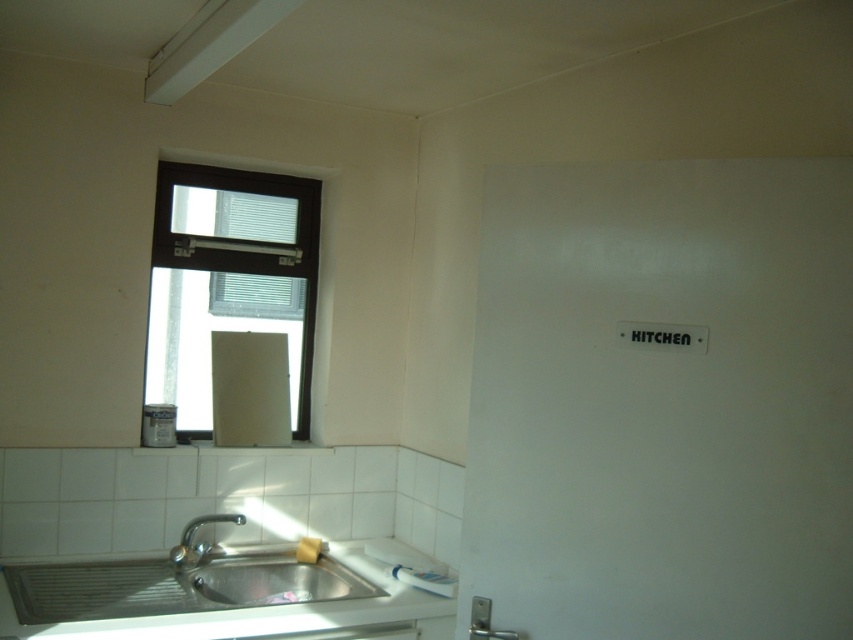
You are a chef preparing to place a cutting board on the white glossy countertop at lower left and the satin nickel faucet at sink left. Which surface is more accessible for you to reach without moving your position?

The white glossy countertop at lower left is closer to the viewer than the satin nickel faucet at sink left, so it is more accessible to reach without moving your position.

You are standing in the kitchen and want to open the brown matte window at upper left to let in some fresh air. Based on the coordinates provided, can you estimate its location relative to the sink?

The brown matte window at upper left is located at coordinates point (228, 280), which places it to the left of the sink in the kitchen.

You are standing in the kitchen and want to wash dishes in the sink. To your left, you see the brown matte window at upper left and the white glossy countertop at lower left. Which object is positioned to the left of the other?

The brown matte window at upper left is to the left of the white glossy countertop at lower left.